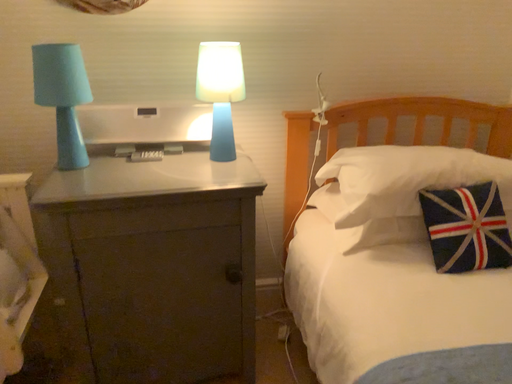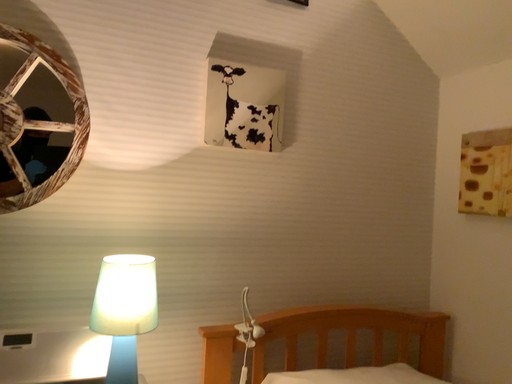
Question: How did the camera likely rotate when shooting the video?

Choices:
 (A) rotated right
 (B) rotated left

Answer: (A)